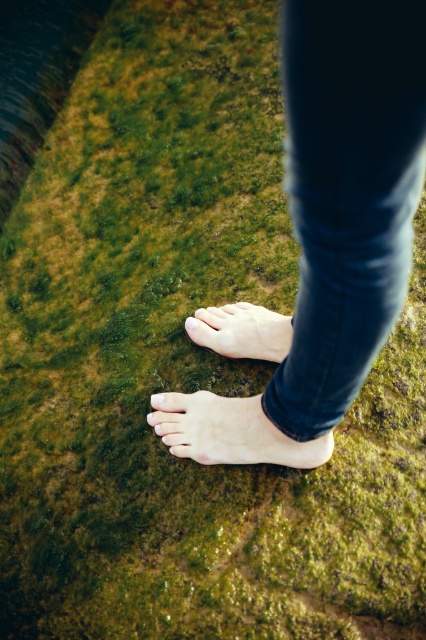
Question: Is dark blue denim jeans at center to the left of pale skin foot at center from the viewer's perspective?

Choices:
 (A) yes
 (B) no

Answer: (B)

Question: Does pale skin foot at center lie behind white matte toe at center?

Choices:
 (A) yes
 (B) no

Answer: (B)

Question: Which point is farther from the camera taking this photo?

Choices:
 (A) (233, 323)
 (B) (196, 323)
 (C) (158, 401)

Answer: (B)

Question: Does pale skin foot at center appear over white matte toe at center?

Choices:
 (A) yes
 (B) no

Answer: (A)

Question: Which point is closer to the camera?

Choices:
 (A) dark blue denim jeans at center
 (B) pale skin toe at center
 (C) smooth skin foot at center

Answer: (A)

Question: Which object is the closest to the pale skin toe at center?

Choices:
 (A) dark blue denim jeans at center
 (B) pale skin foot at center

Answer: (B)